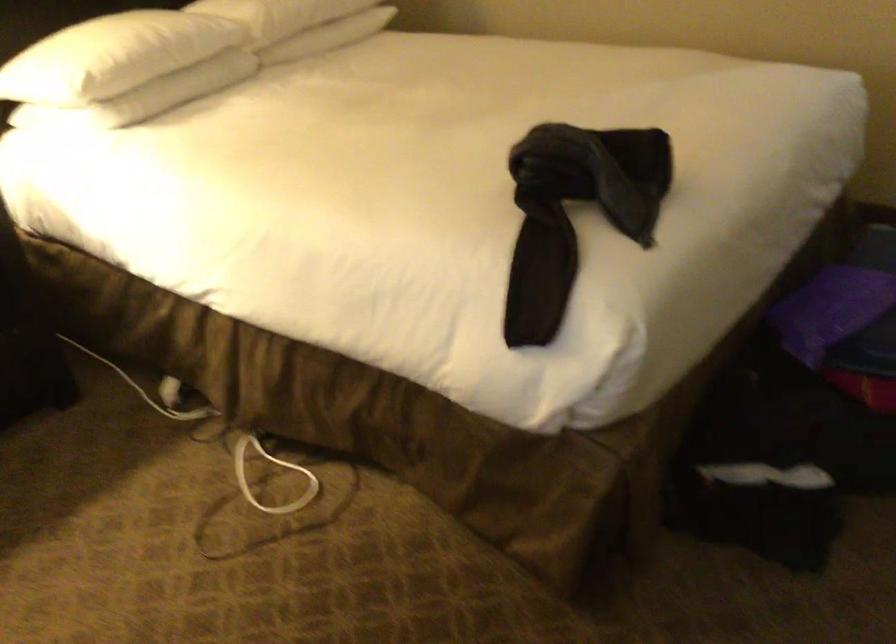
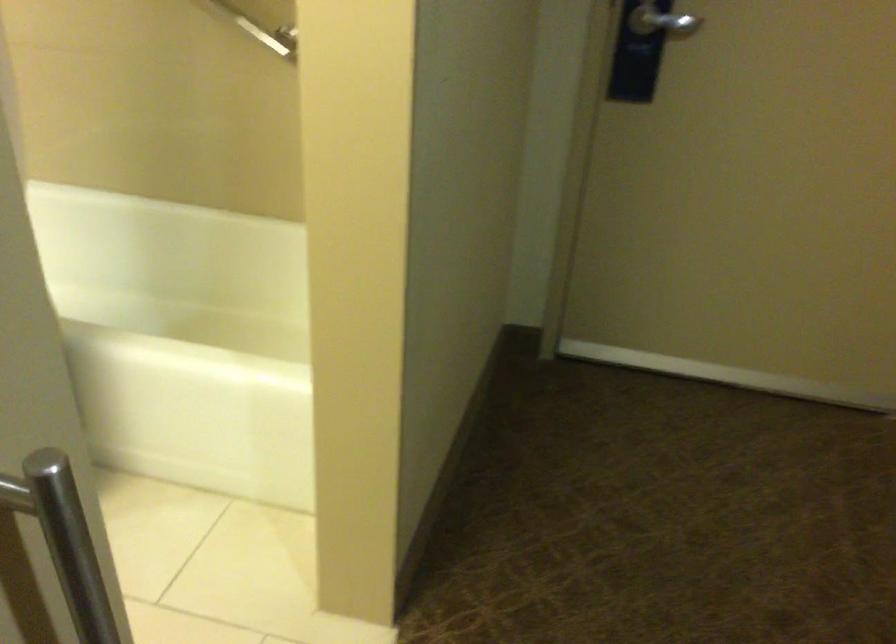
In a continuous first-person perspective shot, in which direction is the camera moving?

The cameraman moved toward right, forward.